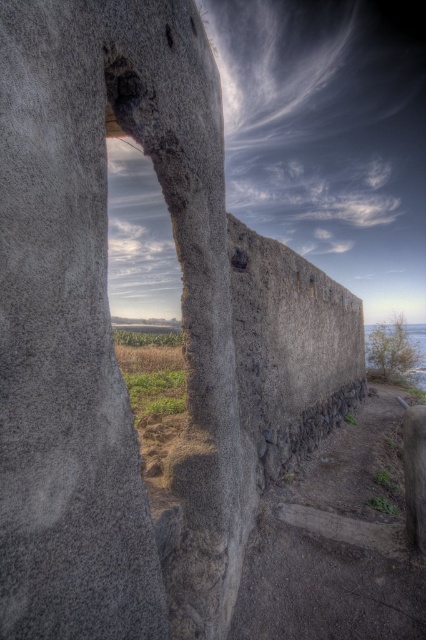
Question: Which of the following is the closest to the observer?

Choices:
 (A) (394, 608)
 (B) (189, 19)

Answer: (B)

Question: Can you confirm if smooth concrete hole at center is positioned above smooth stone hole at upper center?

Choices:
 (A) no
 (B) yes

Answer: (A)

Question: Among these points, which one is nearest to the camera?

Choices:
 (A) (166, 38)
 (B) (408, 612)

Answer: (A)

Question: Does gray rough concrete crack at center appear under smooth concrete hole at center?

Choices:
 (A) no
 (B) yes

Answer: (B)

Question: Which of the following is the farthest from the observer?

Choices:
 (A) gray rough concrete crack at center
 (B) smooth stone hole at upper center

Answer: (A)

Question: Is smooth concrete hole at center further to the viewer compared to smooth stone hole at upper center?

Choices:
 (A) no
 (B) yes

Answer: (A)